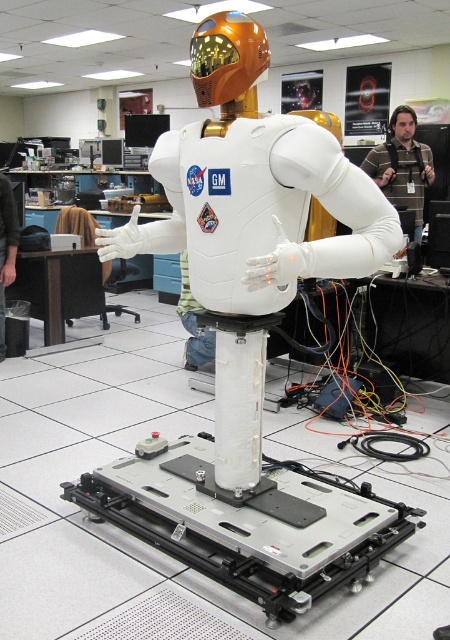
Which is behind, point (171, 554) or point (397, 173)?

The point (397, 173) is more distant.

Is metallic silver platform at center smaller than brown striped shirt at center?

Correct, metallic silver platform at center occupies less space than brown striped shirt at center.

Identify the location of metallic silver platform at center. Image resolution: width=450 pixels, height=640 pixels. (250, 524).

Find the location of `metallic silver platform at center`. metallic silver platform at center is located at coordinates (250, 524).

Is brown striped shirt at center further to the viewer compared to dark gray fabric shirt at lower left?

Yes, it is behind dark gray fabric shirt at lower left.

Image resolution: width=450 pixels, height=640 pixels. Identify the location of brown striped shirt at center. (401, 164).

Find the location of a particular element. This screenshot has height=640, width=450. brown striped shirt at center is located at coordinates (401, 164).

Locate an element on the screen. This screenshot has width=450, height=640. brown striped shirt at center is located at coordinates (401, 164).

Who is taller, metallic silver platform at center or dark gray fabric shirt at lower left?

dark gray fabric shirt at lower left

Measure the distance between metallic silver platform at center and dark gray fabric shirt at lower left.

2.70 meters

Between point (136, 465) and point (4, 186), which one is positioned behind?

Positioned behind is point (4, 186).

You are a GUI agent. You are given a task and a screenshot of the screen. Output one action in this format:
    pyautogui.click(x=<x>, y=<y>)
    Task: Click on the metallic silver platform at center
    
    Given the screenshot: What is the action you would take?
    pyautogui.click(x=250, y=524)